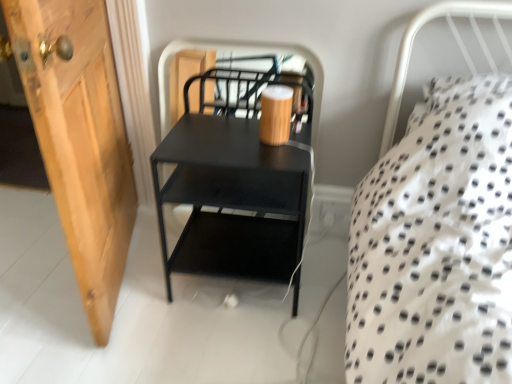
Question: From a real-world perspective, is wooden door at left physically above black matte nightstand at center?

Choices:
 (A) yes
 (B) no

Answer: (A)

Question: Is wooden door at left located outside black matte nightstand at center?

Choices:
 (A) yes
 (B) no

Answer: (A)

Question: Is wooden door at left oriented towards black matte nightstand at center?

Choices:
 (A) no
 (B) yes

Answer: (A)

Question: Considering the relative positions of wooden door at left and black matte nightstand at center in the image provided, is wooden door at left to the right of black matte nightstand at center from the viewer's perspective?

Choices:
 (A) yes
 (B) no

Answer: (B)

Question: From the image's perspective, is wooden door at left located beneath black matte nightstand at center?

Choices:
 (A) yes
 (B) no

Answer: (B)

Question: Is wooden door at left turned away from black matte nightstand at center?

Choices:
 (A) yes
 (B) no

Answer: (B)

Question: Considering the relative sizes of black matte nightstand at center and wooden door at left in the image provided, is black matte nightstand at center shorter than wooden door at left?

Choices:
 (A) yes
 (B) no

Answer: (A)

Question: Is black matte nightstand at center beside wooden door at left?

Choices:
 (A) no
 (B) yes

Answer: (A)

Question: Is black matte nightstand at center wider than wooden door at left?

Choices:
 (A) yes
 (B) no

Answer: (B)

Question: Is wooden door at left at the back of black matte nightstand at center?

Choices:
 (A) no
 (B) yes

Answer: (A)

Question: Can you confirm if black matte nightstand at center is positioned to the left of wooden door at left?

Choices:
 (A) yes
 (B) no

Answer: (B)

Question: Does black matte nightstand at center have a larger size compared to wooden door at left?

Choices:
 (A) no
 (B) yes

Answer: (B)

Question: From a real-world perspective, relative to black matte nightstand at center, is wooden door at left vertically above or below?

Choices:
 (A) above
 (B) below

Answer: (A)